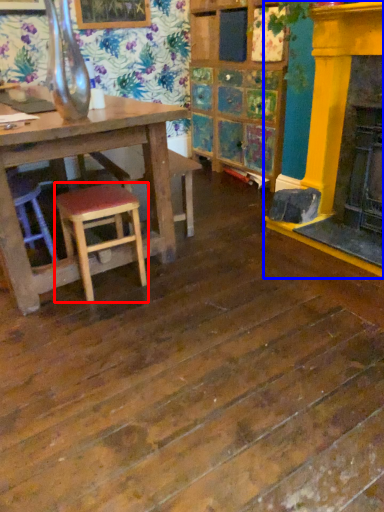
Question: Which object appears farthest to the camera in this image, stool (highlighted by a red box) or fireplace (highlighted by a blue box)?

Choices:
 (A) stool
 (B) fireplace

Answer: (B)